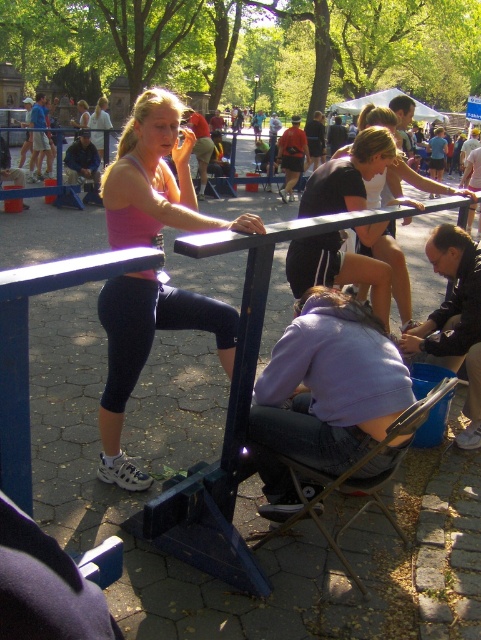
Question: Does pink fabric tank top at center appear under purple fleece jacket at lower center?

Choices:
 (A) no
 (B) yes

Answer: (A)

Question: Can you confirm if pink fabric tank top at center is bigger than metallic silver chair at lower center?

Choices:
 (A) yes
 (B) no

Answer: (B)

Question: Is dark brown leather jacket at lower right above matte black shirt at center?

Choices:
 (A) no
 (B) yes

Answer: (A)

Question: Which object appears farthest from the camera in this image?

Choices:
 (A) dark brown leather jacket at lower right
 (B) metallic silver chair at lower center
 (C) matte black shirt at center

Answer: (C)

Question: Which point appears closest to the camera in this image?

Choices:
 (A) (459, 353)
 (B) (164, 500)

Answer: (B)

Question: Which of the following is the closest to the observer?

Choices:
 (A) (137, 106)
 (B) (379, 248)

Answer: (A)